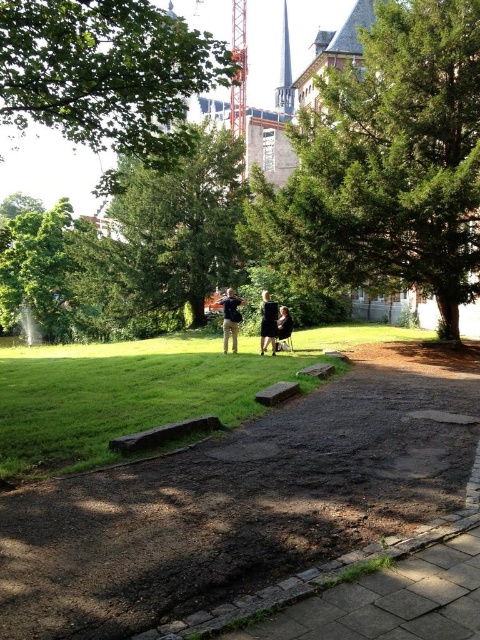
Image resolution: width=480 pixels, height=640 pixels. What are the coordinates of `orange metallic crane at upper center` in the screenshot? It's located at (239, 68).

Consider the image. Between orange metallic crane at upper center and dark blue fabric jacket at center, which one is positioned lower?

dark blue fabric jacket at center

What do you see at coordinates (239, 68) in the screenshot? The width and height of the screenshot is (480, 640). I see `orange metallic crane at upper center` at bounding box center [239, 68].

Identify the location of orange metallic crane at upper center. (239, 68).

From the picture: Between brown dirt path at center and dark blue fabric jacket at center, which one is positioned higher?

dark blue fabric jacket at center

Identify the location of brown dirt path at center. This screenshot has height=640, width=480. (242, 500).

This screenshot has width=480, height=640. I want to click on brown dirt path at center, so [242, 500].

Who is taller, green textured tree at center or green leafy tree at upper center?

With more height is green textured tree at center.

Image resolution: width=480 pixels, height=640 pixels. Describe the element at coordinates (387, 164) in the screenshot. I see `green textured tree at center` at that location.

You are a GUI agent. You are given a task and a screenshot of the screen. Output one action in this format:
    pyautogui.click(x=<x>, y=<y>)
    Task: Click on the green textured tree at center
    
    Given the screenshot: What is the action you would take?
    pyautogui.click(x=387, y=164)

The image size is (480, 640). Identify the location of green textured tree at center. (387, 164).